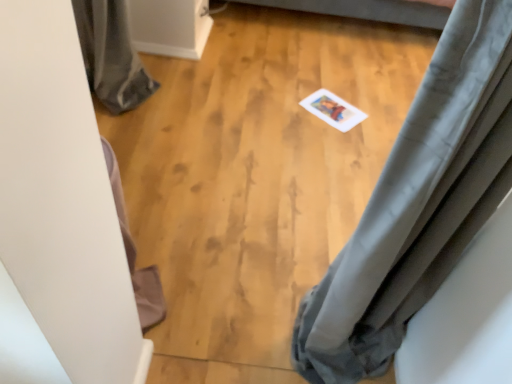
This screenshot has height=384, width=512. Find the location of `vacant space in front of white paper at center`. vacant space in front of white paper at center is located at coordinates (334, 141).